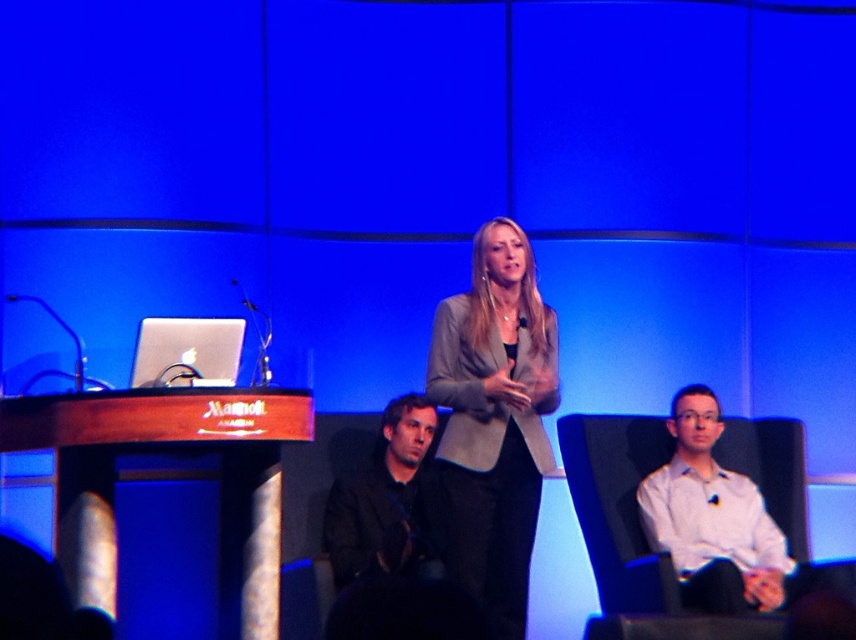
Looking at this image, you are an event photographer who needs to capture a closeup shot of the white shirt at right. Based on its coordinates, where should you position your camera to focus?

The white shirt at right is located at coordinates point [711,516], so you should position your camera to focus on that point.

You are a photographer setting up for a formal event. You need to ensure that the matte gray blazer at center and the white shirt at right are both visible in your photo. Based on their positions, which one will appear higher in the frame?

The matte gray blazer at center appears higher in the frame because it is positioned above the white shirt at right.

You are an event planner setting up a stage for a presentation. You need to place a decorative item exactly at the point with coordinates (494, 420). According to the scene description, what object is located at this position?

The point at coordinates (494, 420) corresponds to the matte gray blazer at center.